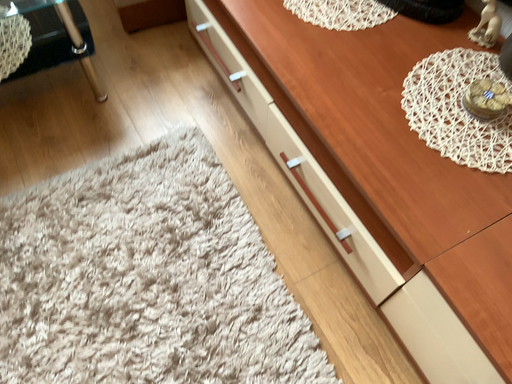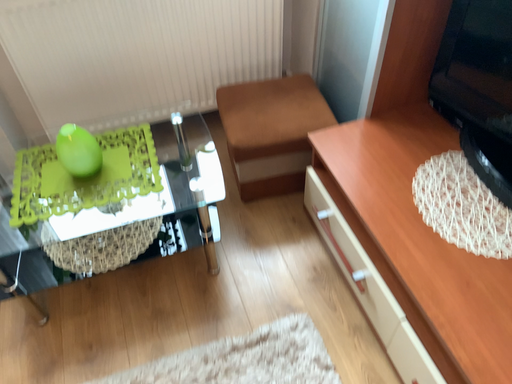
Question: Which way did the camera rotate in the video?

Choices:
 (A) rotated right
 (B) rotated left

Answer: (B)